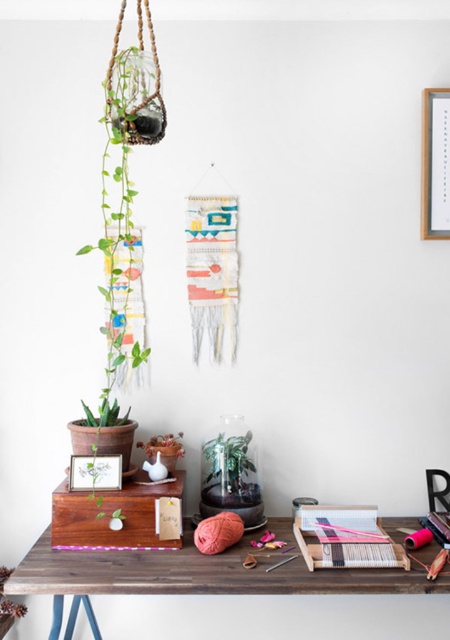
Does wooden picture frame at upper right have a smaller size compared to knitted pink yarn at center?

No, wooden picture frame at upper right is not smaller than knitted pink yarn at center.

Between point (423, 99) and point (211, 529), which one is positioned in front?

Point (211, 529)

Image resolution: width=450 pixels, height=640 pixels. In order to click on wooden picture frame at upper right in this screenshot , I will do `click(435, 164)`.

Does point (62, 620) come farther from viewer compared to point (117, 276)?

No, it is not.

In the scene shown: Measure the distance between point (64, 570) and camera.

6.22 feet

Identify the location of wooden table at lower center. The height and width of the screenshot is (640, 450). [x=167, y=576].

Identify the location of wooden table at lower center. (167, 576).

Is wooden table at lower center further to camera compared to matte wood picture frame at lower left?

No, wooden table at lower center is in front of matte wood picture frame at lower left.

Where is `wooden table at lower center`? This screenshot has width=450, height=640. wooden table at lower center is located at coordinates [x=167, y=576].